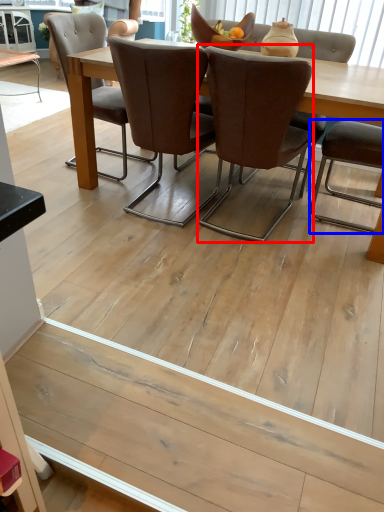
Question: Which of the following is the farthest to the observer, chair (highlighted by a red box) or chair (highlighted by a blue box)?

Choices:
 (A) chair
 (B) chair

Answer: (B)